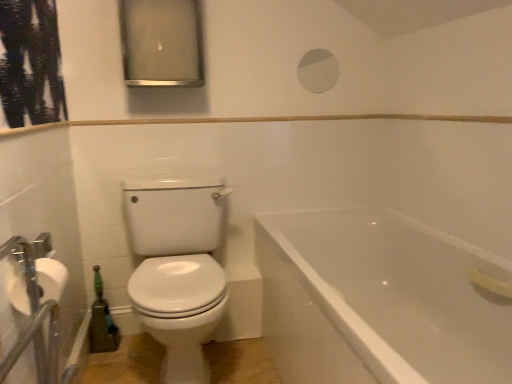
Question: From the image's perspective, is white glossy toilet at left under matte silver medicine cabinet at upper center?

Choices:
 (A) yes
 (B) no

Answer: (A)

Question: Is white glossy toilet at left facing away from matte silver medicine cabinet at upper center?

Choices:
 (A) yes
 (B) no

Answer: (B)

Question: Would you say white glossy toilet at left is outside matte silver medicine cabinet at upper center?

Choices:
 (A) yes
 (B) no

Answer: (A)

Question: Does white glossy toilet at left have a lesser width compared to matte silver medicine cabinet at upper center?

Choices:
 (A) no
 (B) yes

Answer: (A)

Question: Can matte silver medicine cabinet at upper center be found inside white glossy toilet at left?

Choices:
 (A) yes
 (B) no

Answer: (B)

Question: Looking at the image, does white glossy bathtub at lower right seem bigger or smaller compared to white matte toilet paper at left?

Choices:
 (A) small
 (B) big

Answer: (B)

Question: From a real-world perspective, is white glossy bathtub at lower right positioned above or below white matte toilet paper at left?

Choices:
 (A) below
 (B) above

Answer: (A)

Question: Choose the correct answer: Is white glossy bathtub at lower right inside white matte toilet paper at left or outside it?

Choices:
 (A) inside
 (B) outside

Answer: (B)

Question: Is point (309, 324) positioned closer to the camera than point (28, 314)?

Choices:
 (A) farther
 (B) closer

Answer: (A)

Question: Is point (181, 375) closer or farther from the camera than point (460, 316)?

Choices:
 (A) closer
 (B) farther

Answer: (B)

Question: From the image's perspective, is white glossy toilet at left located above or below white glossy bathtub at lower right?

Choices:
 (A) below
 (B) above

Answer: (B)

Question: Considering their positions, is white glossy toilet at left located in front of or behind white glossy bathtub at lower right?

Choices:
 (A) behind
 (B) front

Answer: (A)

Question: Looking at their shapes, would you say white glossy toilet at left is wider or thinner than white glossy bathtub at lower right?

Choices:
 (A) thin
 (B) wide

Answer: (B)

Question: Is white glossy toilet at left in front of or behind white matte toilet paper at left in the image?

Choices:
 (A) behind
 (B) front

Answer: (A)

Question: Considering the positions of point (131, 221) and point (36, 276), is point (131, 221) closer or farther from the camera than point (36, 276)?

Choices:
 (A) closer
 (B) farther

Answer: (B)